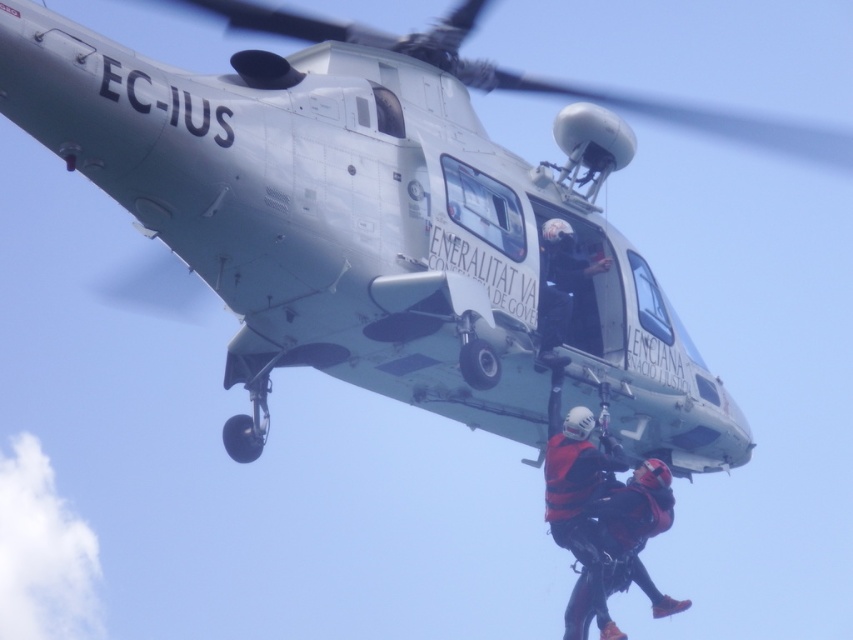
Looking at this image, you are a rescue team member on the ground and need to retrieve the red matte life vest at center from the helicopter. The safety protocol requires that you must stay at least 50 meters away from the helicopter during retrieval. Can you safely retrieve it while maintaining this distance?

The red matte life vest at center and viewer are 76.72 meters apart from each other. Since the required safety distance is 50 meters, you can safely retrieve the red matte life vest at center while maintaining the necessary distance.